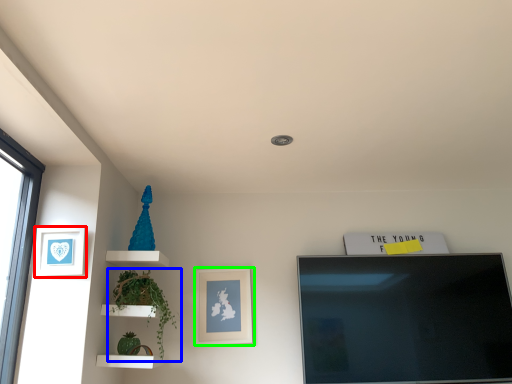
Question: Which object is positioned farthest from picture frame (highlighted by a red box)? Select from plant (highlighted by a blue box) and picture frame (highlighted by a green box).

Choices:
 (A) plant
 (B) picture frame

Answer: (B)